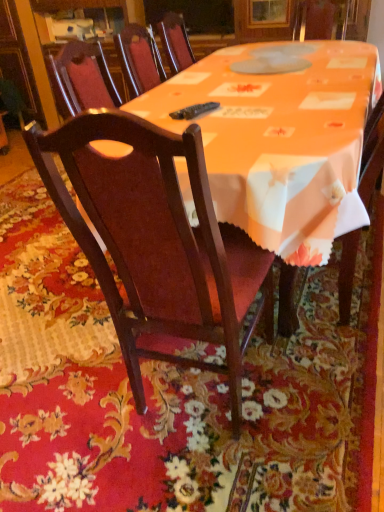
Identify the location of free space on the front side of mahogany wood chair at center. (220, 479).